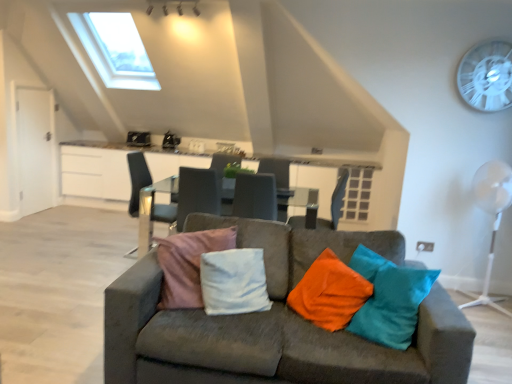
What is the approximate height of matte gray chair at center, which appears as the first chair when viewed from the right?

The height of matte gray chair at center, which appears as the first chair when viewed from the right, is 27.86 inches.

Locate an element on the screen. This screenshot has height=384, width=512. matte gray chair at center, which appears as the first chair when viewed from the right is located at coordinates (335, 203).

You are a GUI agent. You are given a task and a screenshot of the screen. Output one action in this format:
    pyautogui.click(x=<x>, y=<y>)
    Task: Click on the white plastic mechanical fan at right
    
    Given the screenshot: What is the action you would take?
    pyautogui.click(x=493, y=214)

Find the location of a particular element. The height and width of the screenshot is (384, 512). mechanical fan above the metallic silver chair at center, the second chair from the right (from a real-world perspective) is located at coordinates (493, 214).

Considering the relative sizes of white plastic mechanical fan at right and metallic silver chair at center, the second chair from the right, in the image provided, is white plastic mechanical fan at right thinner than metallic silver chair at center, the second chair from the right,?

Correct, the width of white plastic mechanical fan at right is less than that of metallic silver chair at center, the second chair from the right.

Is point (501, 211) closer to camera compared to point (174, 215)?

Yes, point (501, 211) is closer to viewer.

Would you say metallic silver chair at center, the first chair when ordered from left to right, is part of white plastic mechanical fan at right's contents?

No, metallic silver chair at center, the first chair when ordered from left to right, is not surrounded by white plastic mechanical fan at right.

Find the location of a particular element. This screenshot has height=384, width=512. mechanical fan in front of the matte gray chair at center, which is the second chair from left to right is located at coordinates (493, 214).

Can you confirm if matte gray chair at center, which appears as the first chair when viewed from the right, is thinner than white plastic mechanical fan at right?

No, matte gray chair at center, which appears as the first chair when viewed from the right, is not thinner than white plastic mechanical fan at right.

Considering the points (343, 204) and (496, 218), which point is in front, point (343, 204) or point (496, 218)?

The point (496, 218) is in front.

Between matte gray chair at center, which appears as the first chair when viewed from the right, and white plastic mechanical fan at right, which one appears on the left side from the viewer's perspective?

Positioned to the left is matte gray chair at center, which appears as the first chair when viewed from the right.

Is metallic silver chair at center, the second chair from the right, in front of white plastic mechanical fan at right?

No, metallic silver chair at center, the second chair from the right, is further to the viewer.

Considering the sizes of objects metallic silver chair at center, the first chair when ordered from left to right, and white plastic mechanical fan at right in the image provided, who is smaller, metallic silver chair at center, the first chair when ordered from left to right, or white plastic mechanical fan at right?

metallic silver chair at center, the first chair when ordered from left to right.

At what (x,y) coordinates should I click in order to perform the action: click on mechanical fan that is in front of the metallic silver chair at center, the first chair when ordered from left to right. Please return your answer as a coordinate pair (x, y). This screenshot has height=384, width=512. Looking at the image, I should click on (493, 214).

Can we say transparent plastic fan at upper right lies outside metallic silver chair at center, the first chair when ordered from left to right?

Yes, transparent plastic fan at upper right is not within metallic silver chair at center, the first chair when ordered from left to right.

In the image, is transparent plastic fan at upper right positioned in front of or behind metallic silver chair at center, the first chair when ordered from left to right?

In the image, transparent plastic fan at upper right appears in front of metallic silver chair at center, the first chair when ordered from left to right.

From the image's perspective, between transparent plastic fan at upper right and metallic silver chair at center, the second chair from the right, who is located below?

metallic silver chair at center, the second chair from the right, is shown below in the image.

Considering the sizes of transparent plastic fan at upper right and metallic silver chair at center, the first chair when ordered from left to right, in the image, is transparent plastic fan at upper right bigger or smaller than metallic silver chair at center, the first chair when ordered from left to right,?

transparent plastic fan at upper right is smaller than metallic silver chair at center, the first chair when ordered from left to right.

How many degrees apart are the facing directions of velvet grey couch at center and metallic silver chair at center, the first chair when ordered from left to right?

The angular difference between velvet grey couch at center and metallic silver chair at center, the first chair when ordered from left to right, is 86.7 degrees.

Is point (377, 246) farther from camera compared to point (148, 187)?

No.

Is velvet grey couch at center smaller than metallic silver chair at center, the first chair when ordered from left to right?

Answer: No.

Considering the relative sizes of velvet grey couch at center and metallic silver chair at center, the second chair from the right, in the image provided, is velvet grey couch at center thinner than metallic silver chair at center, the second chair from the right,?

In fact, velvet grey couch at center might be wider than metallic silver chair at center, the second chair from the right.

Is white plastic mechanical fan at right at the back of velvet grey couch at center?

No, white plastic mechanical fan at right is not at the back of velvet grey couch at center.

Is point (279, 238) positioned after point (501, 297)?

No, (279, 238) is closer to viewer.

Is velvet grey couch at center positioned in front of white plastic mechanical fan at right?

Yes, it is.

Considering the sizes of objects velvet grey couch at center and white plastic mechanical fan at right in the image provided, who is taller, velvet grey couch at center or white plastic mechanical fan at right?

white plastic mechanical fan at right is taller.

Is matte gray chair at center, which appears as the first chair when viewed from the right, surrounded by metallic silver chair at center, the first chair when ordered from left to right?

That's incorrect, matte gray chair at center, which appears as the first chair when viewed from the right, is not inside metallic silver chair at center, the first chair when ordered from left to right.

Can you tell me how much metallic silver chair at center, the second chair from the right, and matte gray chair at center, which is the second chair from left to right, differ in facing direction?

There is a 178-degree angle between the facing directions of metallic silver chair at center, the second chair from the right, and matte gray chair at center, which is the second chair from left to right.

Is metallic silver chair at center, the first chair when ordered from left to right, positioned with its back to matte gray chair at center, which appears as the first chair when viewed from the right?

metallic silver chair at center, the first chair when ordered from left to right, is not turned away from matte gray chair at center, which appears as the first chair when viewed from the right.

Considering the positions of points (165, 181) and (293, 216), is point (165, 181) farther from camera compared to point (293, 216)?

That is True.

You are a GUI agent. You are given a task and a screenshot of the screen. Output one action in this format:
    pyautogui.click(x=<x>, y=<y>)
    Task: Click on the mechanical fan in front of the metallic silver chair at center, the second chair from the right
    Image resolution: width=512 pixels, height=384 pixels.
    Given the screenshot: What is the action you would take?
    pyautogui.click(x=493, y=214)

Locate an element on the screen. The height and width of the screenshot is (384, 512). the 2nd chair above when counting from the white plastic mechanical fan at right (from the image's perspective) is located at coordinates click(335, 203).

Based on their spatial positions, is velvet grey couch at center or white plastic mechanical fan at right further from transparent plastic fan at upper right?

velvet grey couch at center is positioned further to the anchor transparent plastic fan at upper right.

From the image, which object appears to be nearer to white plastic mechanical fan at right, transparent plastic fan at upper right or matte gray chair at center, which appears as the first chair when viewed from the right?

The object closer to white plastic mechanical fan at right is transparent plastic fan at upper right.

Based on the photo, looking at the image, which one is located further to transparent plastic fan at upper right, matte gray chair at center, which is the second chair from left to right, or metallic silver chair at center, the first chair when ordered from left to right?

metallic silver chair at center, the first chair when ordered from left to right, lies further to transparent plastic fan at upper right than the other object.

When comparing their distances from matte gray chair at center, which appears as the first chair when viewed from the right, does transparent plastic fan at upper right or white plastic mechanical fan at right seem further?

transparent plastic fan at upper right.

Considering their positions, is velvet grey couch at center positioned further to matte gray chair at center, which appears as the first chair when viewed from the right, than metallic silver chair at center, the first chair when ordered from left to right?

velvet grey couch at center is further to matte gray chair at center, which appears as the first chair when viewed from the right.

Looking at the image, which one is located closer to velvet grey couch at center, white plastic mechanical fan at right or transparent plastic fan at upper right?

white plastic mechanical fan at right.

Looking at the image, which one is located closer to matte gray chair at center, which appears as the first chair when viewed from the right, velvet grey couch at center or transparent plastic fan at upper right?

Based on the image, transparent plastic fan at upper right appears to be nearer to matte gray chair at center, which appears as the first chair when viewed from the right.

Considering their positions, is matte gray chair at center, which is the second chair from left to right, positioned further to metallic silver chair at center, the first chair when ordered from left to right, than transparent plastic fan at upper right?

transparent plastic fan at upper right lies further to metallic silver chair at center, the first chair when ordered from left to right, than the other object.

You are a GUI agent. You are given a task and a screenshot of the screen. Output one action in this format:
    pyautogui.click(x=<x>, y=<y>)
    Task: Click on the mechanical fan between velvet grey couch at center and matte gray chair at center, which appears as the first chair when viewed from the right, in the front-back direction
    The height and width of the screenshot is (384, 512).
    Given the screenshot: What is the action you would take?
    pyautogui.click(x=493, y=214)

Identify the location of fan positioned between velvet grey couch at center and matte gray chair at center, which is the second chair from left to right, from near to far. The height and width of the screenshot is (384, 512). (487, 76).

Where is `studio couch located between metallic silver chair at center, the first chair when ordered from left to right, and transparent plastic fan at upper right in the left-right direction`? The height and width of the screenshot is (384, 512). studio couch located between metallic silver chair at center, the first chair when ordered from left to right, and transparent plastic fan at upper right in the left-right direction is located at coordinates (274, 323).

Identify the location of studio couch situated between metallic silver chair at center, the first chair when ordered from left to right, and white plastic mechanical fan at right from left to right. The image size is (512, 384). (274, 323).